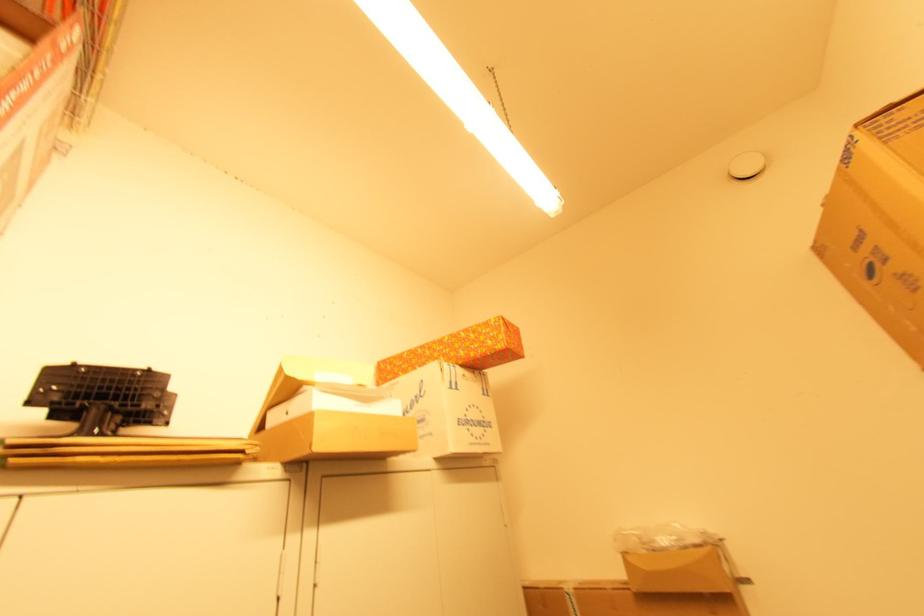
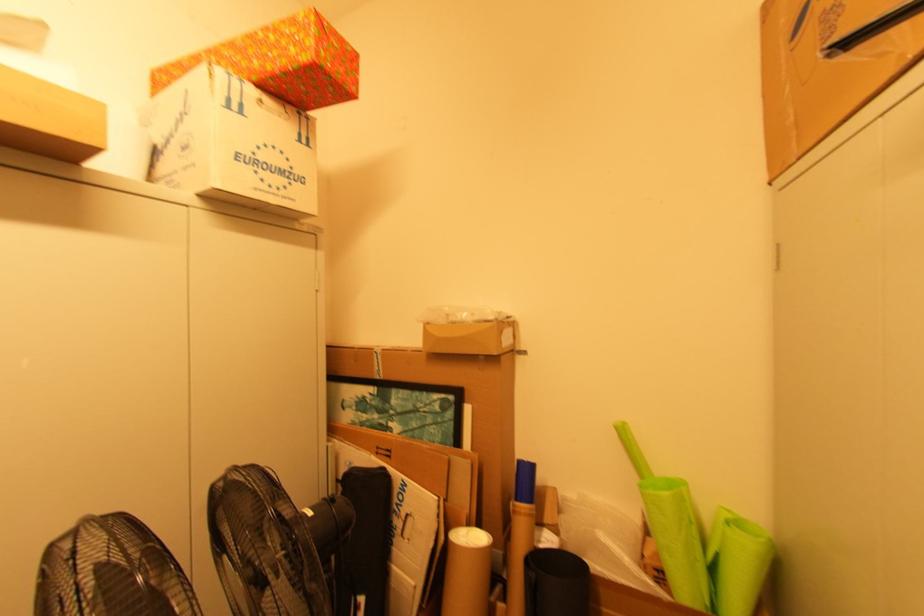
In the second image, find the point that corresponds to (468,416) in the first image.

(257, 154)